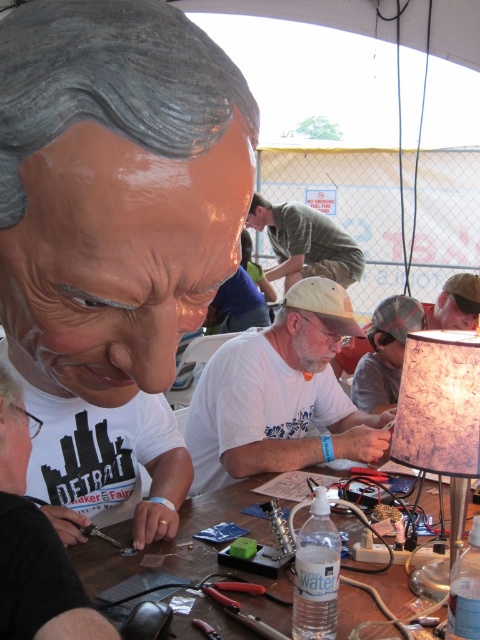
Question: Does white matte t-shirt at center appear on the left side of green fabric shirt at center?

Choices:
 (A) yes
 (B) no

Answer: (A)

Question: Is white matte t-shirt at center smaller than green fabric shirt at center?

Choices:
 (A) no
 (B) yes

Answer: (B)

Question: Estimate the real-world distances between objects in this image. Which object is farther from the green fabric shirt at center?

Choices:
 (A) matte plastic mask at center
 (B) metallic brown table at center
 (C) white matte t-shirt at center

Answer: (C)

Question: Where is metallic brown table at center located in relation to green fabric shirt at center in the image?

Choices:
 (A) below
 (B) above

Answer: (A)

Question: Which of the following is the farthest from the observer?

Choices:
 (A) matte plastic mask at center
 (B) white matte t-shirt at center

Answer: (B)

Question: Estimate the real-world distances between objects in this image. Which object is farther from the white matte t-shirt at center?

Choices:
 (A) marbled paper lampshade at right
 (B) matte plastic mask at center

Answer: (A)